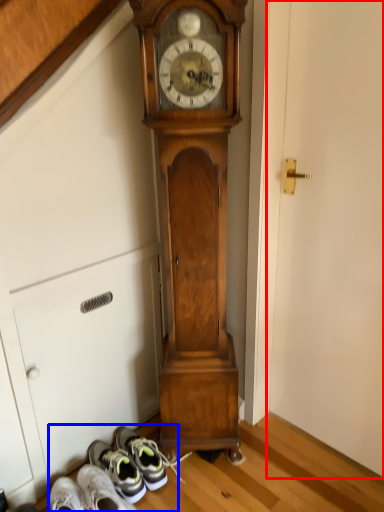
Question: Which point is closer to the camera, door (highlighted by a red box) or shoe (highlighted by a blue box)?

Choices:
 (A) door
 (B) shoe

Answer: (A)